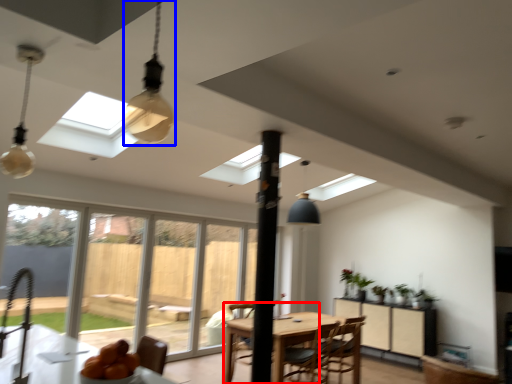
Question: Among these objects, which one is farthest to the camera, chair (highlighted by a red box) or light fixture (highlighted by a blue box)?

Choices:
 (A) chair
 (B) light fixture

Answer: (A)